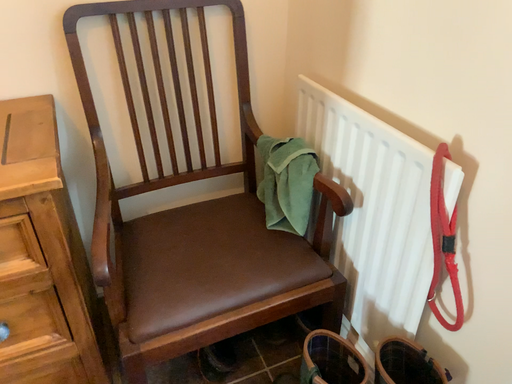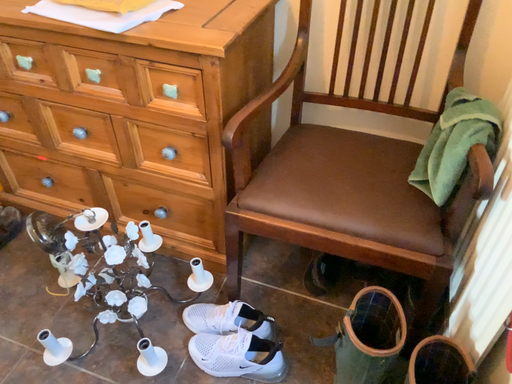
Question: How did the camera likely rotate when shooting the video?

Choices:
 (A) rotated left
 (B) rotated right

Answer: (A)